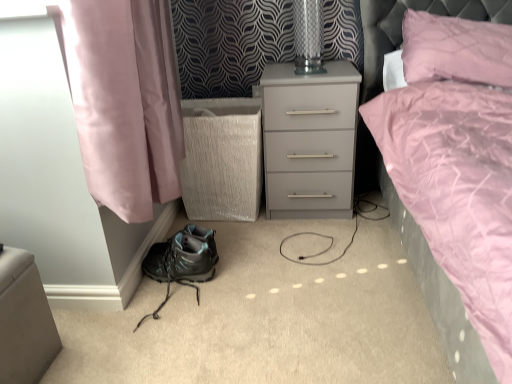
The height and width of the screenshot is (384, 512). I want to click on free spot in front of matte gray nightstand at center, so click(315, 245).